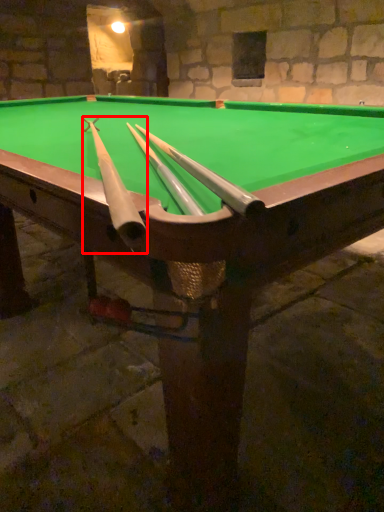
Question: Where is cue (annotated by the red box) located in relation to cue in the image?

Choices:
 (A) left
 (B) right

Answer: (A)